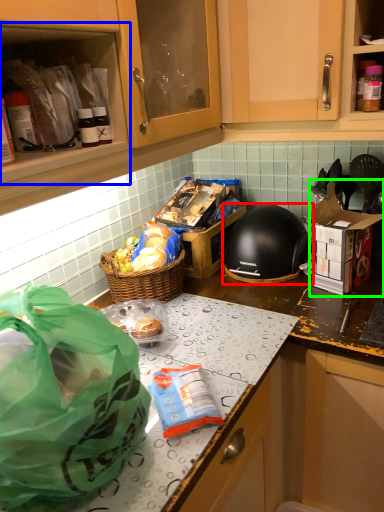
Question: Which is nearer to the helmet (highlighted by a red box)? cabinetry (highlighted by a blue box) or cardboard box (highlighted by a green box).

Choices:
 (A) cabinetry
 (B) cardboard box

Answer: (B)